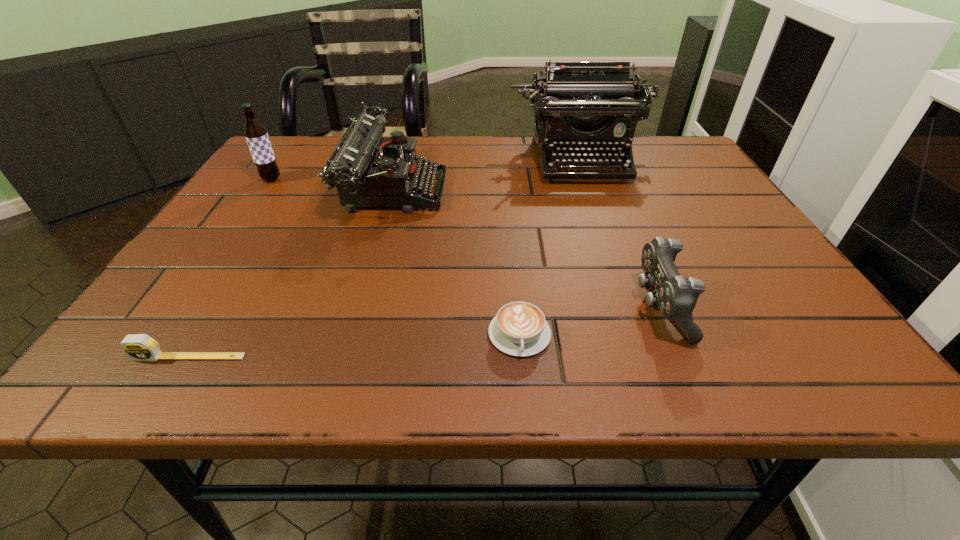
Where is `vacant region located 0.080m on the keyboard of the third tallest object`? The height and width of the screenshot is (540, 960). vacant region located 0.080m on the keyboard of the third tallest object is located at coordinates (478, 190).

Identify the location of free location located on the surface of the fourth tallest object with buttons. This screenshot has height=540, width=960. (569, 308).

I want to click on blank area located 0.360m on the surface of the fourth tallest object with buttons, so click(x=435, y=308).

This screenshot has width=960, height=540. Find the location of `free spot located 0.350m on the surface of the fourth tallest object with buttons`. free spot located 0.350m on the surface of the fourth tallest object with buttons is located at coordinates (441, 308).

Locate an element on the screen. The width and height of the screenshot is (960, 540). root beer that is positioned at the far edge is located at coordinates (255, 133).

Locate an element on the screen. The image size is (960, 540). control situated at the near edge is located at coordinates (674, 296).

Find the location of a particular element. tape measure that is at the near edge is located at coordinates (139, 347).

Identify the location of cappuccino present at the near edge. The height and width of the screenshot is (540, 960). (519, 328).

Locate an element on the screen. This screenshot has height=540, width=960. root beer positioned at the left edge is located at coordinates coord(255,133).

Locate an element on the screen. This screenshot has height=540, width=960. tape measure at the left edge is located at coordinates (139, 347).